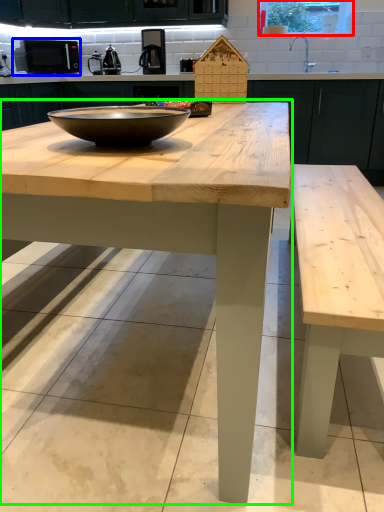
Question: Considering the real-world distances, which object is closest to window screen (highlighted by a red box)? appliance (highlighted by a blue box) or table (highlighted by a green box).

Choices:
 (A) appliance
 (B) table

Answer: (A)